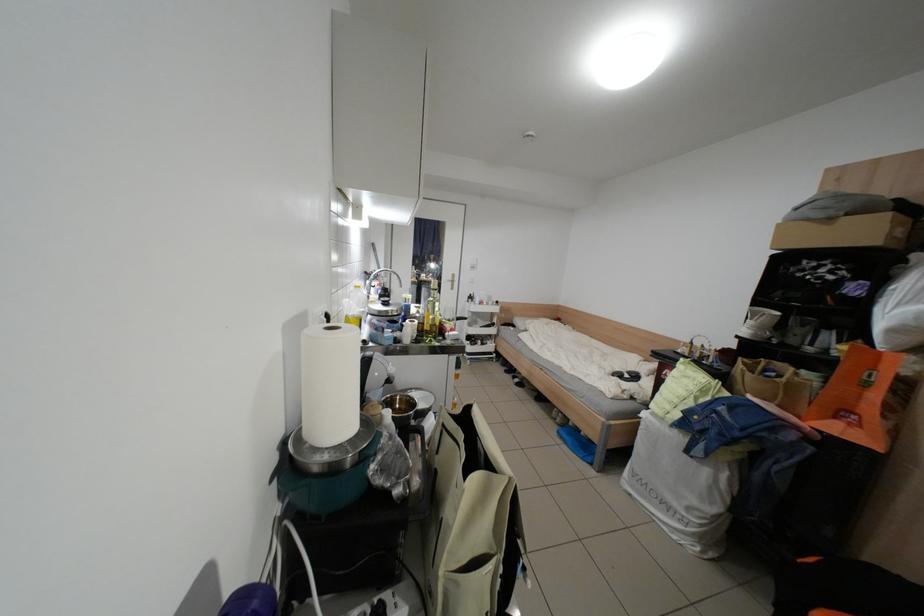
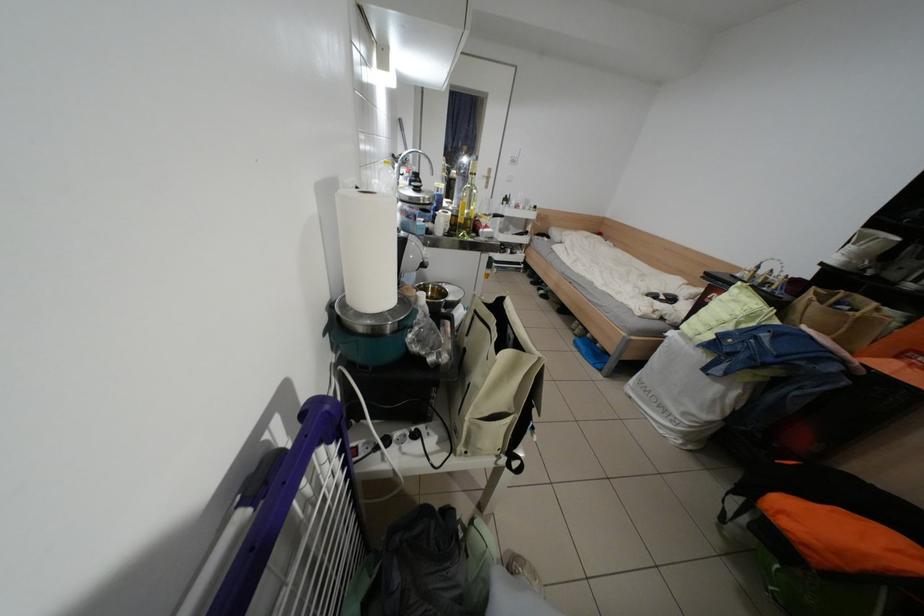
Find the pixel in the second image that matches (348,426) in the first image.

(388, 297)